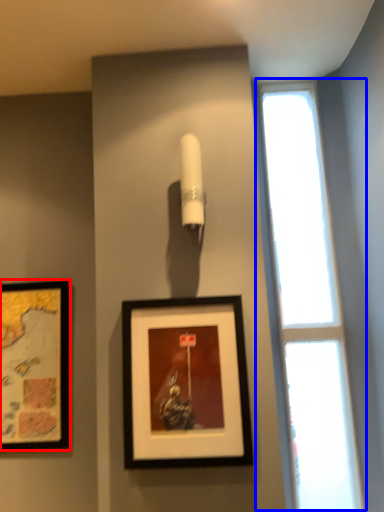
Question: Which point is closer to the camera, picture frame (highlighted by a red box) or window (highlighted by a blue box)?

Choices:
 (A) picture frame
 (B) window

Answer: (B)